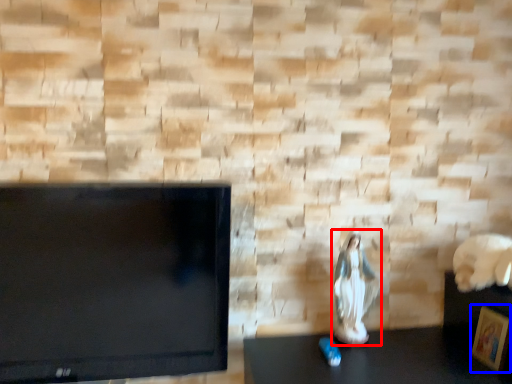
Question: Which object is further to the camera taking this photo, couple (highlighted by a red box) or picture frame (highlighted by a blue box)?

Choices:
 (A) couple
 (B) picture frame

Answer: (A)